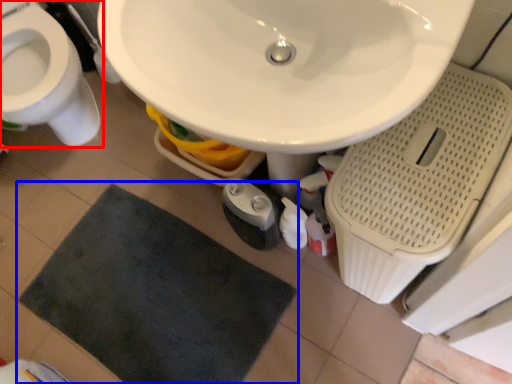
Question: Among these objects, which one is farthest to the camera, toilet (highlighted by a red box) or bath mat (highlighted by a blue box)?

Choices:
 (A) toilet
 (B) bath mat

Answer: (B)